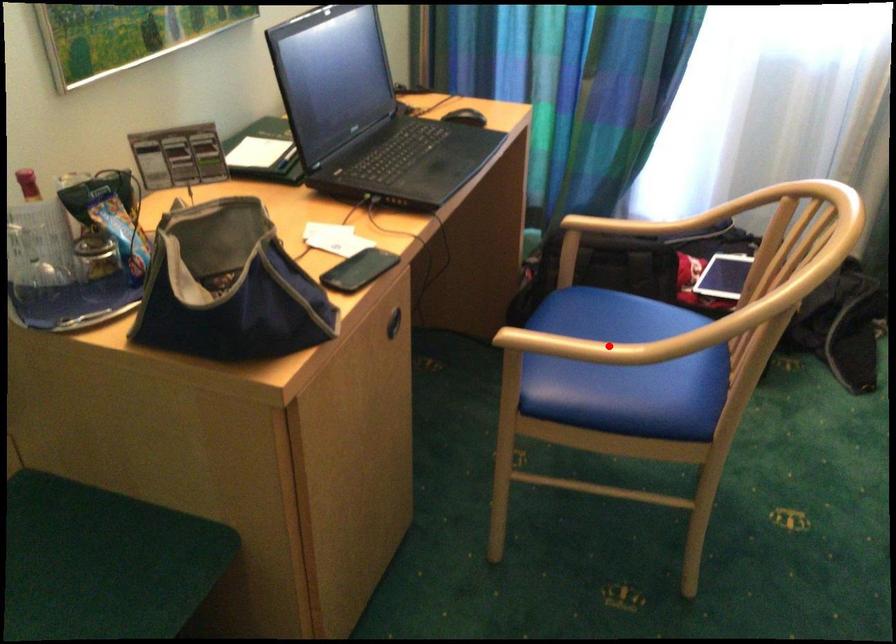
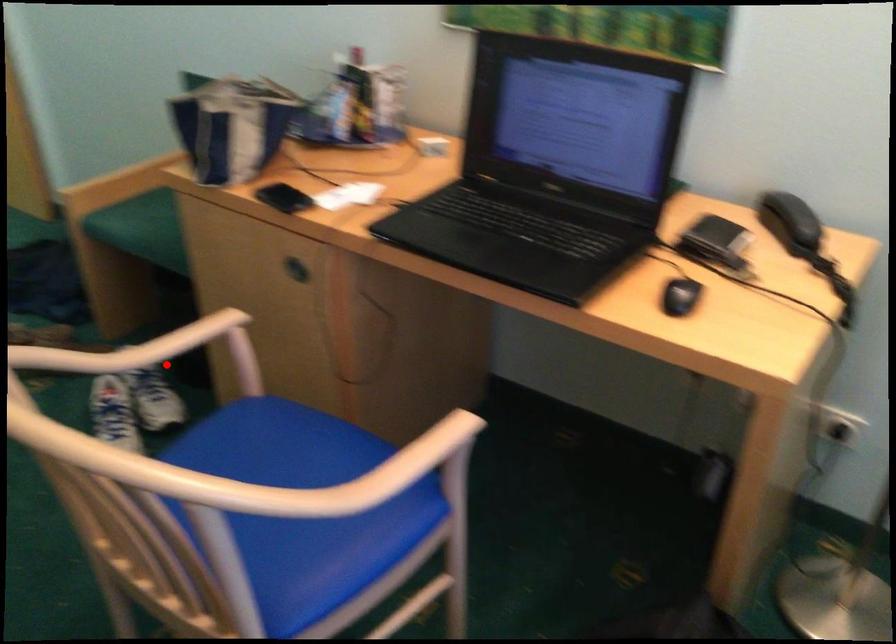
I am providing you with two images of the same scene from different viewpoints. A red point is marked on the first image and another point is marked on the second image. Are the points marked in image1 and image2 representing the same 3D position?

Yes